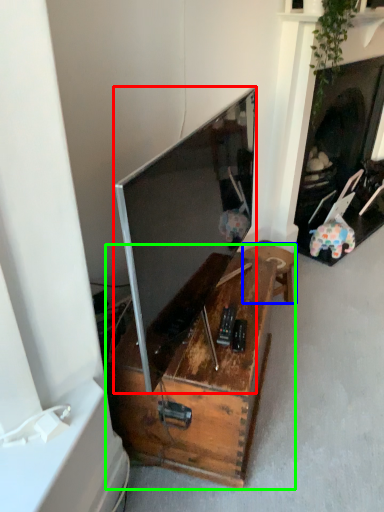
Question: Estimate the real-world distances between objects in this image. Which object is closer to television (highlighted by a red box), furniture (highlighted by a blue box) or table (highlighted by a green box)?

Choices:
 (A) furniture
 (B) table

Answer: (B)